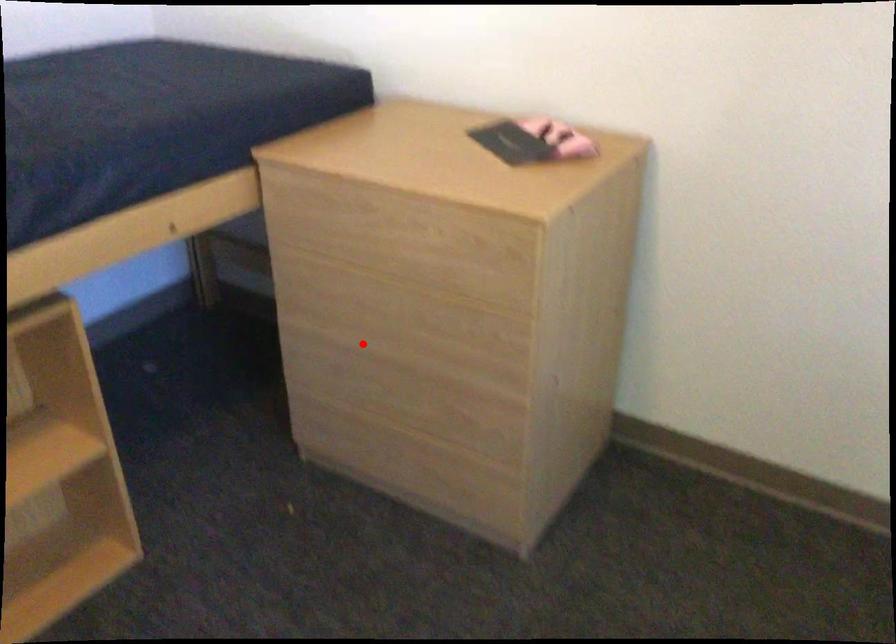
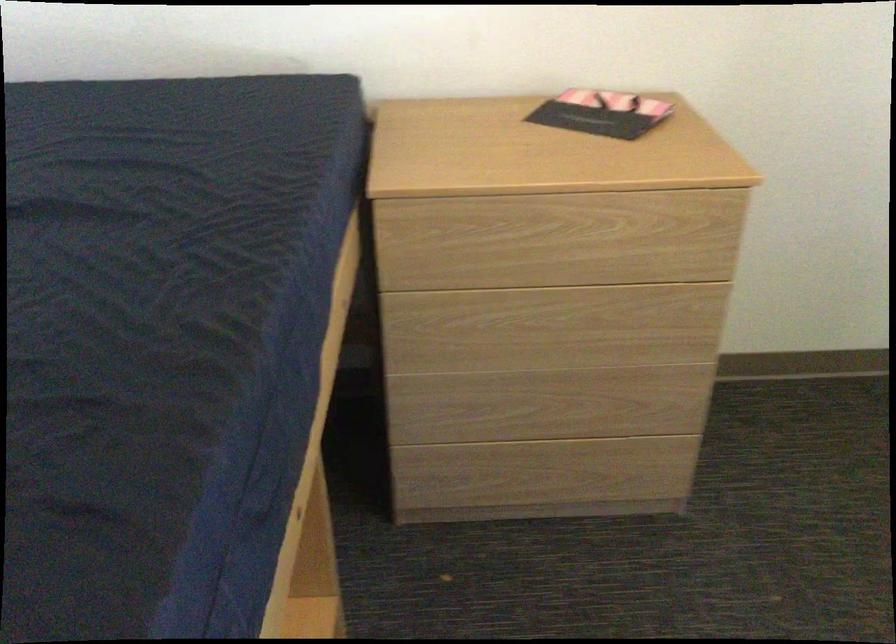
Question: I am providing you with two images of the same scene from different viewpoints. A red point is shown in image1. For the corresponding object point in image2, is it positioned nearer or farther from the camera?

Choices:
 (A) Nearer
 (B) Farther

Answer: (A)